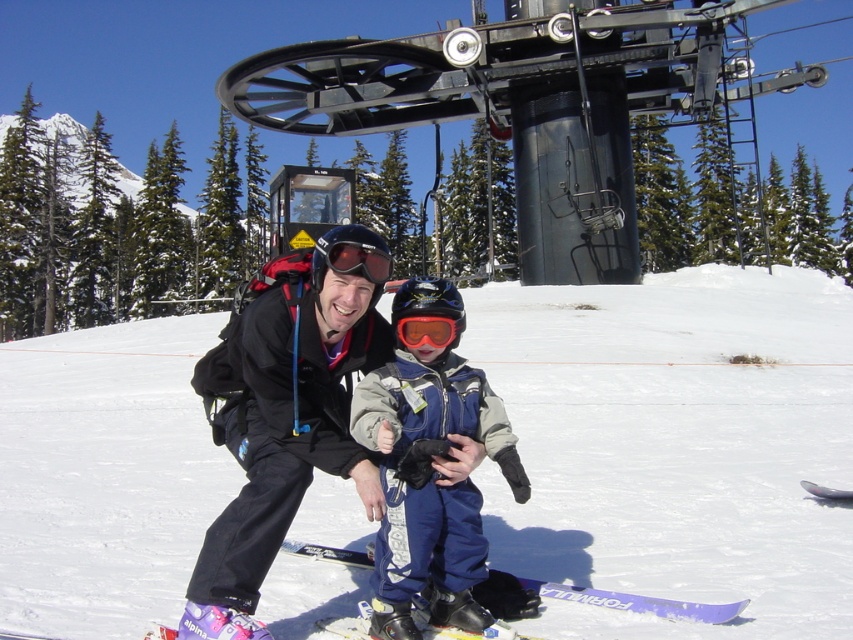
You are a photographer planning to take a picture of the white powder snow at center and the orange reflective goggles at center. Which object will appear closer to the camera in the photo?

The white powder snow at center appears closer to the camera because it is further to the viewer than the orange reflective goggles at center.

You are planning to take a photo of the white powder snow at center while standing at the position marked by coordinates 0.5, 0.5. Will the snow be in the center of your photo if you point your camera directly forward?

The white powder snow at center is located at point (675, 445), which is slightly to the right and above the center point (426, 320). Therefore, pointing the camera directly forward would place the snow slightly off to the right and upper part of the photo, not exactly at the center.

You are a photographer trying to capture the scene with the white powder snow at center and the blue fleece snowsuit at center. Which object should you focus on first if you want to ensure both are in sharp focus?

The blue fleece snowsuit at center should be focused on first because it is closer to the camera than the white powder snow at center, which is further away. By focusing on the closer object, the background will also be in focus due to depth of field.